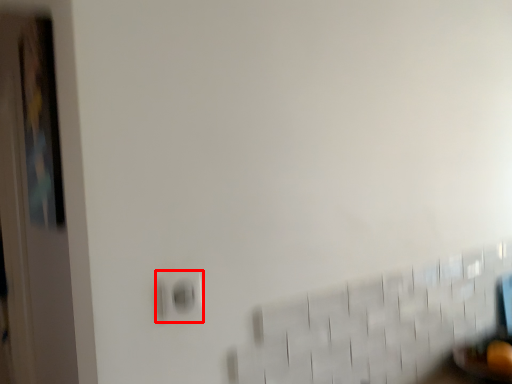
Question: Where is electric outlet (annotated by the red box) located in relation to door in the image?

Choices:
 (A) right
 (B) left

Answer: (A)